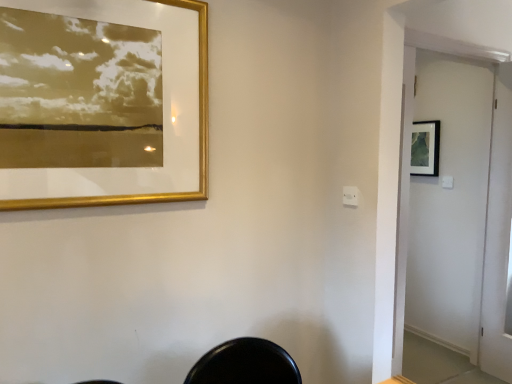
Question: Considering the relative positions of white glossy screen door at right and gold metallic picture frame at upper left, the second picture frame viewed from the back, in the image provided, is white glossy screen door at right to the left of gold metallic picture frame at upper left, the second picture frame viewed from the back, from the viewer's perspective?

Choices:
 (A) yes
 (B) no

Answer: (B)

Question: From the image's perspective, is white glossy screen door at right located beneath gold metallic picture frame at upper left, which appears as the first picture frame when viewed from the left?

Choices:
 (A) no
 (B) yes

Answer: (B)

Question: Does white glossy screen door at right have a smaller size compared to gold metallic picture frame at upper left, which appears as the first picture frame when viewed from the left?

Choices:
 (A) yes
 (B) no

Answer: (B)

Question: Is white glossy screen door at right facing towards gold metallic picture frame at upper left, acting as the second picture frame starting from the right?

Choices:
 (A) yes
 (B) no

Answer: (B)

Question: Is white glossy screen door at right shorter than gold metallic picture frame at upper left, the second picture frame viewed from the back?

Choices:
 (A) yes
 (B) no

Answer: (B)

Question: From the image's perspective, relative to white glossy screen door at right, is matte black picture frame at upper right, which is counted as the 1th picture frame, starting from the right, above or below?

Choices:
 (A) below
 (B) above

Answer: (B)

Question: Considering the relative positions of matte black picture frame at upper right, which is counted as the 1th picture frame, starting from the right, and white glossy screen door at right in the image provided, is matte black picture frame at upper right, which is counted as the 1th picture frame, starting from the right, to the left or to the right of white glossy screen door at right?

Choices:
 (A) right
 (B) left

Answer: (A)

Question: From a real-world perspective, is matte black picture frame at upper right, the 1th picture frame when ordered from back to front, positioned above or below white glossy screen door at right?

Choices:
 (A) below
 (B) above

Answer: (B)

Question: Considering their positions, is matte black picture frame at upper right, the 1th picture frame when ordered from back to front, located in front of or behind white glossy screen door at right?

Choices:
 (A) behind
 (B) front

Answer: (A)

Question: Considering the positions of matte black picture frame at upper right, which is the second picture frame in left-to-right order, and gold metallic picture frame at upper left, which appears as the first picture frame when viewed from the left, in the image, is matte black picture frame at upper right, which is the second picture frame in left-to-right order, wider or thinner than gold metallic picture frame at upper left, which appears as the first picture frame when viewed from the left,?

Choices:
 (A) thin
 (B) wide

Answer: (B)

Question: In terms of height, does matte black picture frame at upper right, the 1th picture frame when ordered from back to front, look taller or shorter compared to gold metallic picture frame at upper left, placed as the first picture frame when sorted from front to back?

Choices:
 (A) short
 (B) tall

Answer: (A)

Question: Considering the positions of point (419, 142) and point (26, 203), is point (419, 142) closer or farther from the camera than point (26, 203)?

Choices:
 (A) farther
 (B) closer

Answer: (A)

Question: Considering the relative positions of matte black picture frame at upper right, the 2th picture frame when ordered from front to back, and gold metallic picture frame at upper left, the second picture frame viewed from the back, in the image provided, is matte black picture frame at upper right, the 2th picture frame when ordered from front to back, to the left or to the right of gold metallic picture frame at upper left, the second picture frame viewed from the back,?

Choices:
 (A) right
 (B) left

Answer: (A)

Question: Looking at their shapes, would you say white glossy screen door at right is wider or thinner than gold metallic picture frame at upper left, which appears as the first picture frame when viewed from the left?

Choices:
 (A) wide
 (B) thin

Answer: (A)

Question: In terms of height, does white glossy screen door at right look taller or shorter compared to gold metallic picture frame at upper left, which appears as the first picture frame when viewed from the left?

Choices:
 (A) tall
 (B) short

Answer: (A)